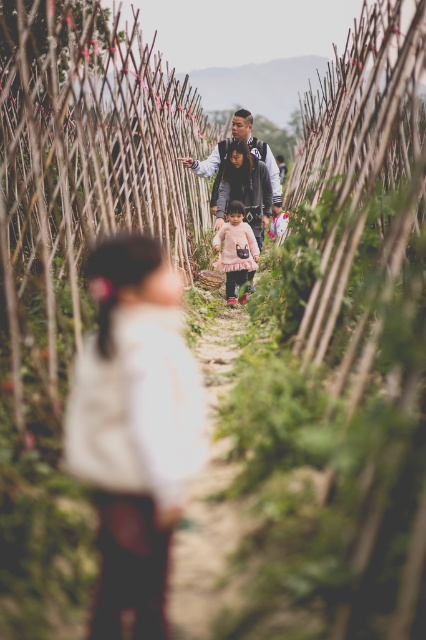
Based on the photo, you are a photographer trying to capture a clear shot of the two people in the scene. The subjects are wearing a matte pink sweater at center and a dark gray jacket at center. Since both are at the center, which clothing item will appear closer to the camera in the photo?

The matte pink sweater at center will appear closer to the camera because it is in front of the dark gray jacket at center.

You are a photographer trying to capture the family walking through the bamboo tunnel. You notice the white soft sweater at center and the pink tulle dress at center. Which clothing item is positioned lower on the person?

The white soft sweater at center is located below the pink tulle dress at center, so it is positioned lower on the person.

You are a photographer trying to capture the family walking through the bamboo pathway. You notice the white soft sweater at center and the pink tulle dress at center. Which clothing item would appear more detailed in the photo if the focus is on the center?

The white soft sweater at center would appear more detailed because it is thinner than the pink tulle dress at center, making it easier to focus on.